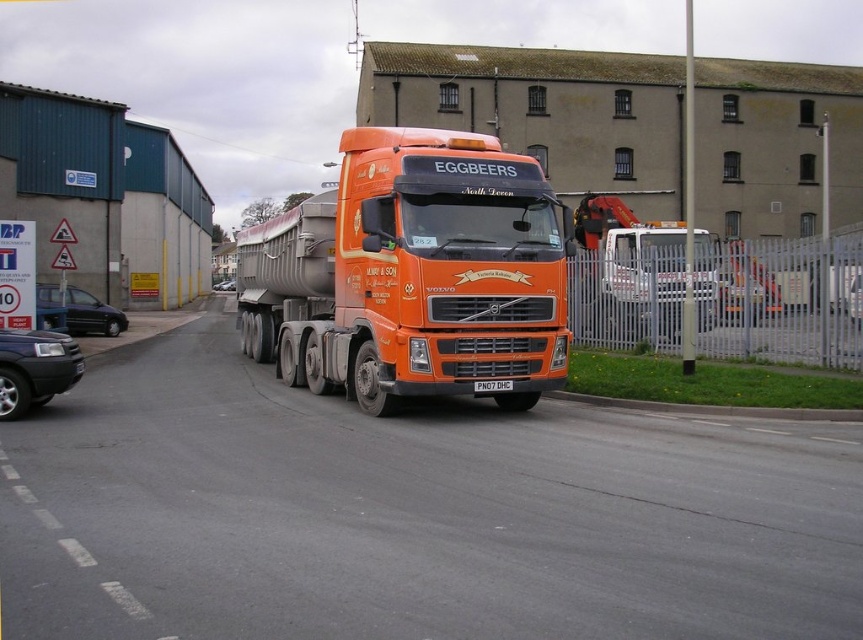
You are a delivery driver who needs to check the license plate number of the black plastic license plate at center. However, your view is partially blocked by the metallic silver car at center. Can you still see the license plate number?

The black plastic license plate at center is located below the metallic silver car at center, so it is likely blocked from view by the car, making it difficult to see the license plate number clearly.

You are a delivery driver who needs to park your truck between the matte black car at lower left and the metallic silver car at center. Based on their positions, can you fit the truck in between them without moving either car?

The matte black car at lower left is below the metallic silver car at center, so there is vertical space between them. However, since the truck requires horizontal space for parking, the vertical arrangement does not provide enough room. Therefore, the truck cannot be parked between them without moving either car.

From the picture: What object is located at the coordinates point (413, 275) in the image?

The point (413, 275) marks the orange matte truck at center.